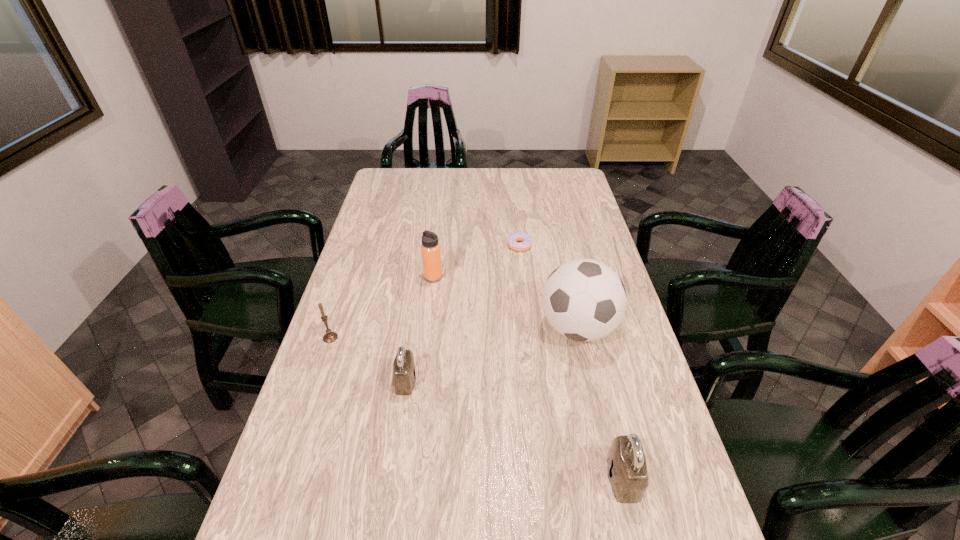
If the aim is uniform spacing by inserting an additional padlock among them, please point to a vacant space for this new padlock. Please provide its 2D coordinates. Your answer should be formatted as a tuple, i.e. [(x, y)], where the tuple contains the x and y coordinates of a point satisfying the conditions above.

[(505, 425)]